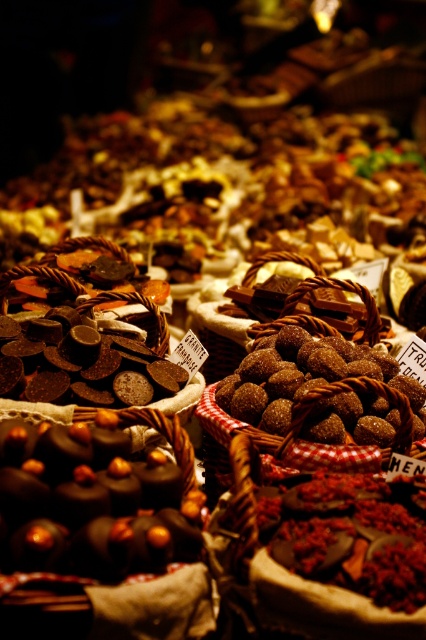
Question: Which of these objects is positioned farthest from the shiny dark chocolate truffles at center?

Choices:
 (A) chocolate-coated nuts at center
 (B) sugared chocolate truffles at center

Answer: (B)

Question: From the image, what is the correct spatial relationship of shiny dark chocolate truffles at center in relation to sugared chocolate truffles at center?

Choices:
 (A) above
 (B) below

Answer: (B)

Question: Is chocolate-coated nuts at center positioned before sugared chocolate at center?

Choices:
 (A) yes
 (B) no

Answer: (A)

Question: Which object appears closest to the camera in this image?

Choices:
 (A) chocolate-coated nuts at center
 (B) sugared chocolate at center
 (C) sugared chocolate truffles at center

Answer: (A)

Question: Which is farther from the sugared chocolate truffles at center?

Choices:
 (A) chocolate-coated nuts at center
 (B) sugared chocolate at center
 (C) shiny dark chocolate truffles at center

Answer: (C)

Question: Does shiny dark chocolate truffles at center have a greater width compared to sugared chocolate at center?

Choices:
 (A) yes
 (B) no

Answer: (B)